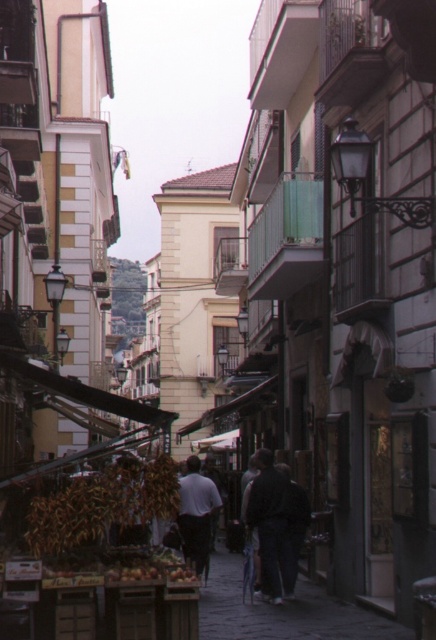
Question: Which object appears farthest from the camera in this image?

Choices:
 (A) dark gray fabric pants at center
 (B) light gray fabric shirt at center
 (C) dark gray jacket at center

Answer: (A)

Question: Does brown matte dried corn at center have a larger size compared to dark gray jacket at center?

Choices:
 (A) no
 (B) yes

Answer: (A)

Question: Does brown matte dried corn at center appear on the right side of shiny red apples at center?

Choices:
 (A) yes
 (B) no

Answer: (B)

Question: Which of these objects is positioned closest to the shiny red apples at center?

Choices:
 (A) light gray fabric shirt at center
 (B) brown matte dried corn at center

Answer: (B)

Question: Does dark gray jacket at center have a lesser width compared to light gray fabric shirt at center?

Choices:
 (A) yes
 (B) no

Answer: (A)

Question: Which of the following is the farthest from the observer?

Choices:
 (A) (166, 504)
 (B) (181, 481)

Answer: (B)